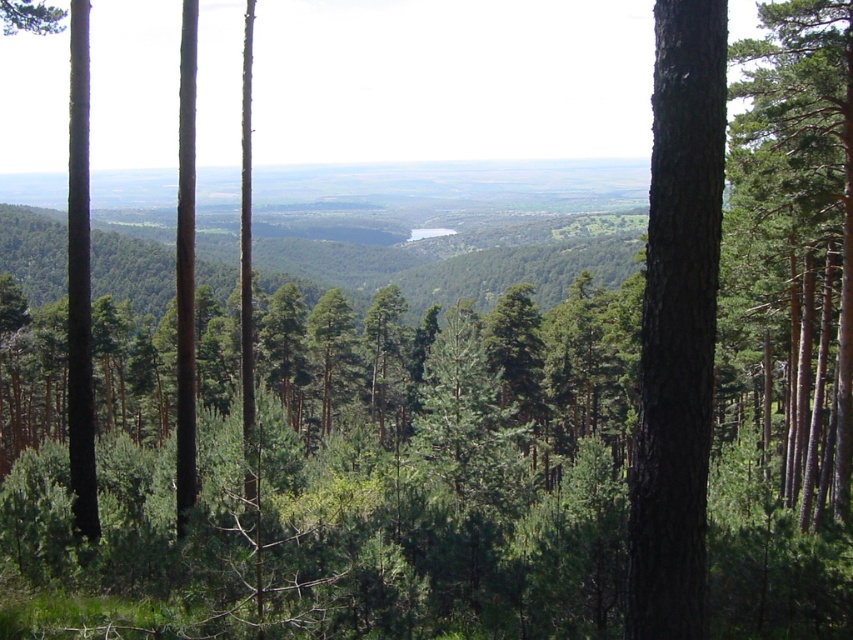
Is point (708, 417) closer to viewer compared to point (749, 80)?

Yes, point (708, 417) is closer to viewer.

Consider the image. Can you confirm if brown rough bark tree at right is positioned to the left of green matte tree at right?

Correct, you'll find brown rough bark tree at right to the left of green matte tree at right.

Between point (683, 524) and point (747, 58), which one is positioned in front?

Point (683, 524) is more forward.

Identify the location of brown rough bark tree at right. The width and height of the screenshot is (853, 640). (677, 323).